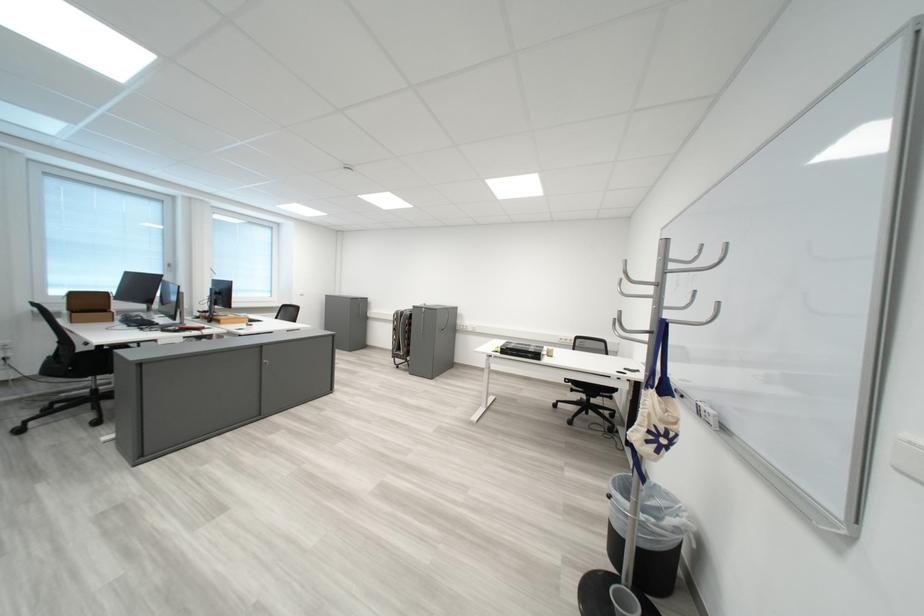
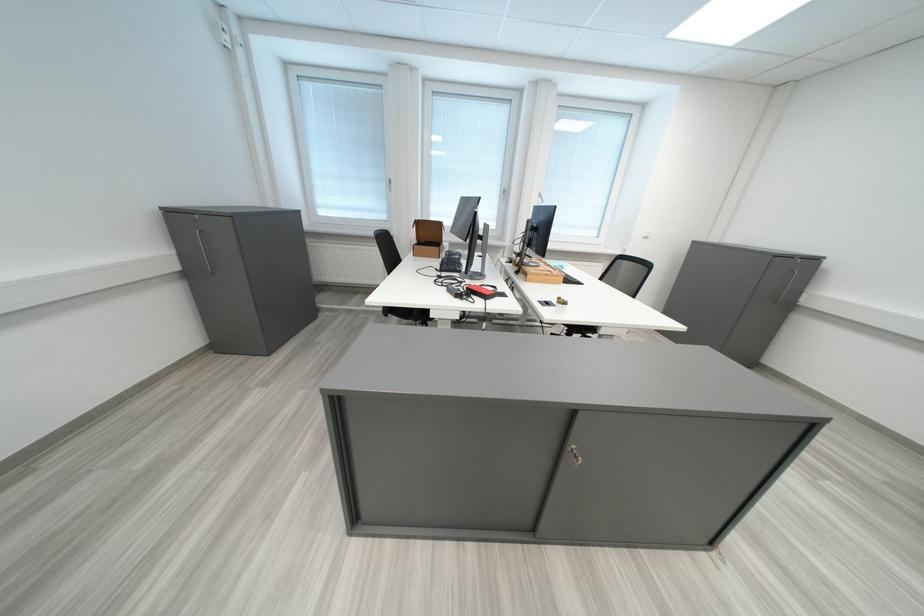
Where in the second image is the point corresponding to the point at 131,320 from the first image?

(456, 256)